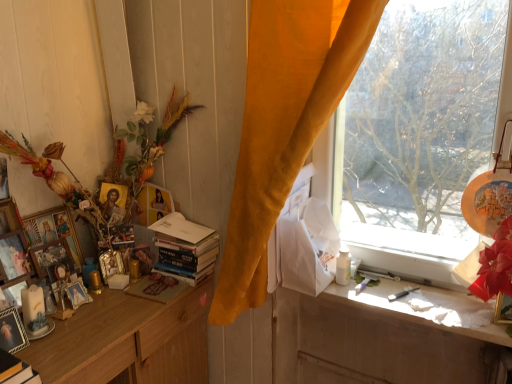
Locate an element on the screen. The height and width of the screenshot is (384, 512). vacant space in wooden textured vase at left (from a real-world perspective) is located at coordinates (104, 312).